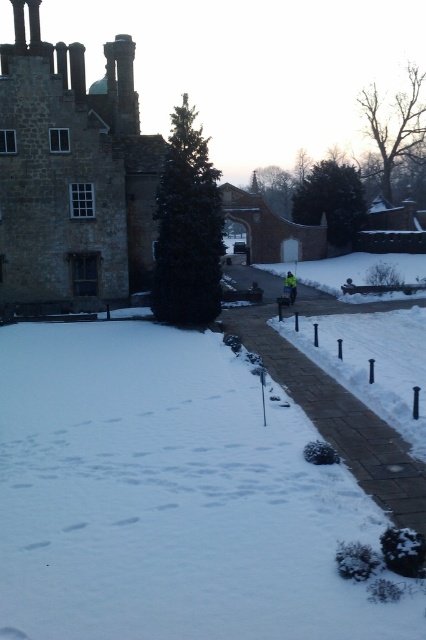
You are a delivery person approaching the historic stone building and see the brick paved path at center and the yellow reflective jacket at center. Which object is higher in elevation?

The brick paved path at center is much taller than the yellow reflective jacket at center, so the brick paved path at center is higher in elevation.

Based on the photo, you are a delivery person arriving at the historic stone building. You need to leave your delivery cart on the brick paved path at center so you can enter the building through its arched doorway. However, you must ensure the cart won,t block the yellow reflective jacket at center. Given that the cart is 2 meters long, can you safely park the cart on the path without it overlapping the jacket?

The brick paved path at center is 6.59 meters away from the yellow reflective jacket at center. Since the cart is only 2 meters long, there is sufficient space between them to park the cart on the path without overlapping the jacket.